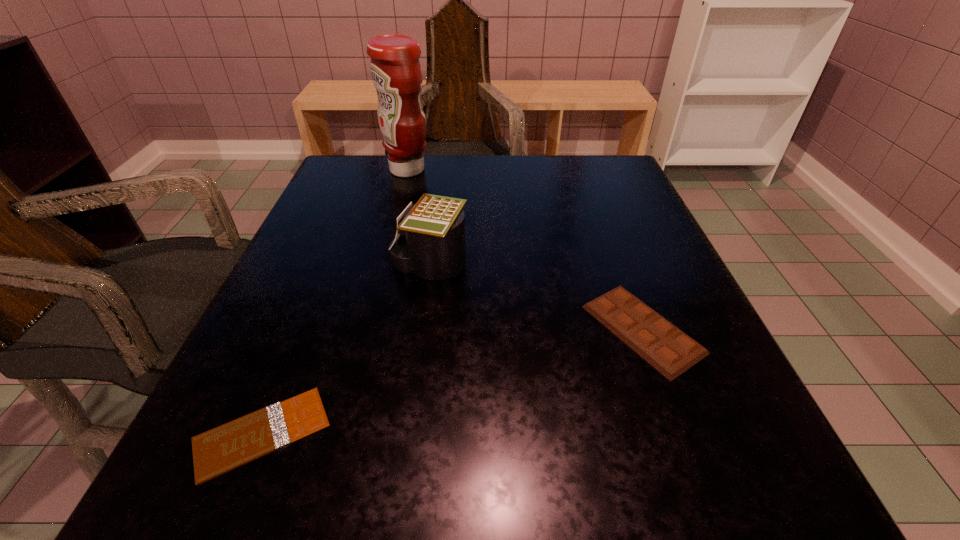
Where is `vacant point that satisfies the following two spatial constraints: 1. on the back side of the farther chocolate bar; 2. on the right side of the nearest object`? The image size is (960, 540). vacant point that satisfies the following two spatial constraints: 1. on the back side of the farther chocolate bar; 2. on the right side of the nearest object is located at coordinates (303, 329).